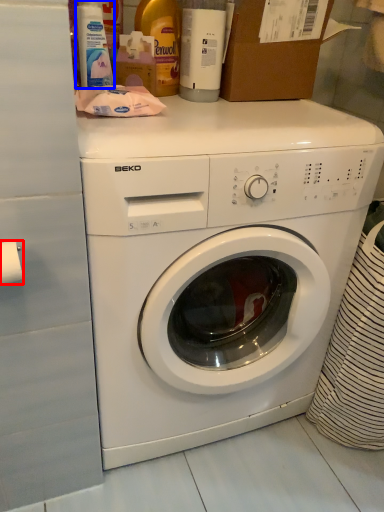
Question: Which point is closer to the camera, toilet paper (highlighted by a red box) or cleaning product (highlighted by a blue box)?

Choices:
 (A) toilet paper
 (B) cleaning product

Answer: (A)